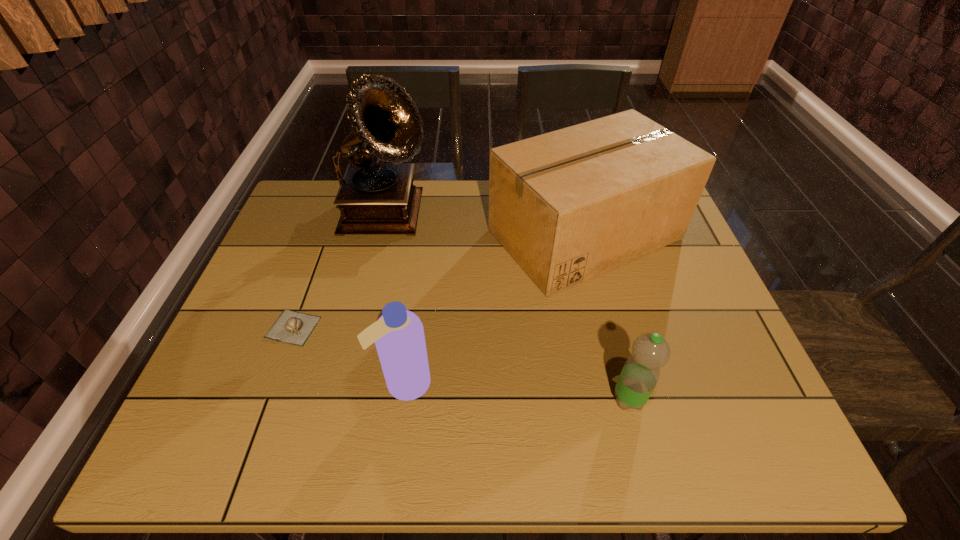
Find the location of `the tallest object`. the tallest object is located at coordinates (374, 198).

Find the location of a particular element. This screenshot has width=960, height=540. box is located at coordinates (568, 205).

This screenshot has width=960, height=540. Identify the location of shampoo. (398, 334).

Where is `the second shortest object`? This screenshot has height=540, width=960. the second shortest object is located at coordinates (650, 351).

Where is `garlic`? This screenshot has width=960, height=540. garlic is located at coordinates (292, 327).

You are a GUI agent. You are given a task and a screenshot of the screen. Output one action in this format:
    pyautogui.click(x=<x>, y=<y>)
    Task: Click on the third nearest object
    The image size is (960, 540).
    Given the screenshot: What is the action you would take?
    pyautogui.click(x=292, y=327)

Identify the location of free space located 0.330m on the horn of the tallest object. The width and height of the screenshot is (960, 540). (540, 217).

Image resolution: width=960 pixels, height=540 pixels. What are the coordinates of `vacant space located 0.360m on the left of the box` in the screenshot? It's located at (368, 234).

You are a GUI agent. You are given a task and a screenshot of the screen. Output one action in this format:
    pyautogui.click(x=<x>, y=<y>)
    Task: Click on the free space located 0.100m on the left of the shampoo
    Image resolution: width=960 pixels, height=540 pixels.
    Given the screenshot: What is the action you would take?
    click(x=331, y=383)

Find the location of a particular element. The width and height of the screenshot is (960, 540). blank area located 0.240m on the right of the water bottle is located at coordinates (757, 399).